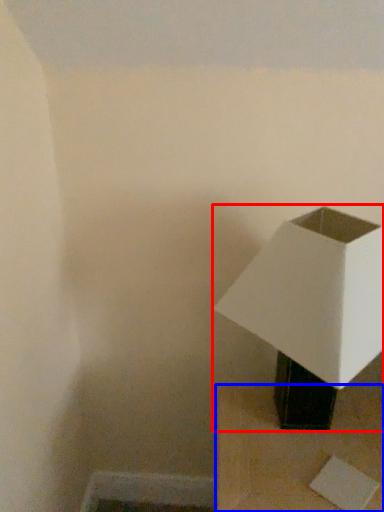
Question: Which of the following is the closest to the observer, lamp (highlighted by a red box) or furniture (highlighted by a blue box)?

Choices:
 (A) lamp
 (B) furniture

Answer: (A)